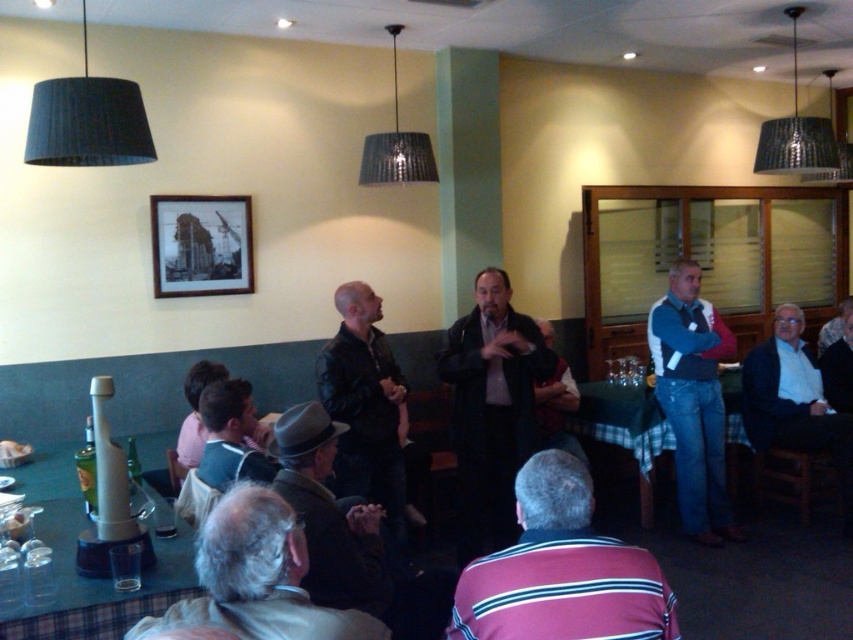
Question: Which object is positioned farthest from the blue jeans at right?

Choices:
 (A) black wood picture frame at upper center
 (B) white cotton shirt at lower right

Answer: (A)

Question: Is striped cotton shirt at lower center positioned before dark gray coat at center?

Choices:
 (A) no
 (B) yes

Answer: (B)

Question: Is gray felt hat at lower left in front of black wood picture frame at upper center?

Choices:
 (A) no
 (B) yes

Answer: (B)

Question: Which of these objects is positioned closest to the gray woolen sweater at lower left?

Choices:
 (A) green plaid tablecloth at lower right
 (B) plastic/transparent glasses at lower left
 (C) black leather jacket at center
 (D) dark brown leather jacket at lower left

Answer: (B)

Question: Can you confirm if plastic/transparent glasses at lower left is wider than dark brown leather jacket at lower left?

Choices:
 (A) no
 (B) yes

Answer: (B)

Question: Which point is closer to the camera?

Choices:
 (A) (291, 520)
 (B) (712, 369)
 (C) (218, 232)

Answer: (A)